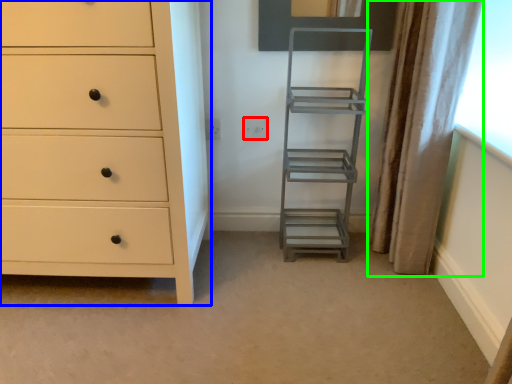
Question: Estimate the real-world distances between objects in this image. Which object is closer to electric outlet (highlighted by a red box), chest of drawers (highlighted by a blue box) or curtain (highlighted by a green box)?

Choices:
 (A) chest of drawers
 (B) curtain

Answer: (B)